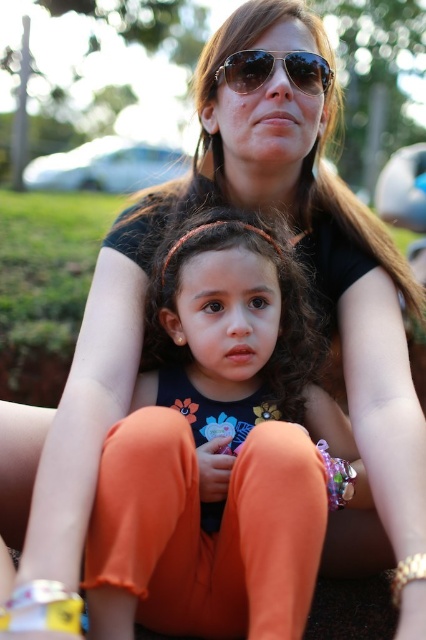
Is point (321, 467) positioned behind point (290, 80)?

That is False.

Which is behind, point (270, 541) or point (293, 76)?

The point (293, 76) is behind.

I want to click on orange fabric pants at center, so click(x=218, y=449).

Can you confirm if metallic aviator sunglasses at center is shorter than white fabric bracelet at lower left?

No, metallic aviator sunglasses at center is not shorter than white fabric bracelet at lower left.

Locate an element on the screen. The image size is (426, 640). metallic aviator sunglasses at center is located at coordinates click(273, 70).

Can you confirm if orange fabric pants at center is positioned to the left of metallic gold bracelet at lower right?

Yes, orange fabric pants at center is to the left of metallic gold bracelet at lower right.

Is orange fabric pants at center behind metallic gold bracelet at lower right?

No, orange fabric pants at center is closer to the viewer.

Who is more forward, (224, 486) or (402, 568)?

Point (402, 568)

You are a GUI agent. You are given a task and a screenshot of the screen. Output one action in this format:
    pyautogui.click(x=<x>, y=<y>)
    Task: Click on the orange fabric pants at center
    
    Given the screenshot: What is the action you would take?
    (218, 449)